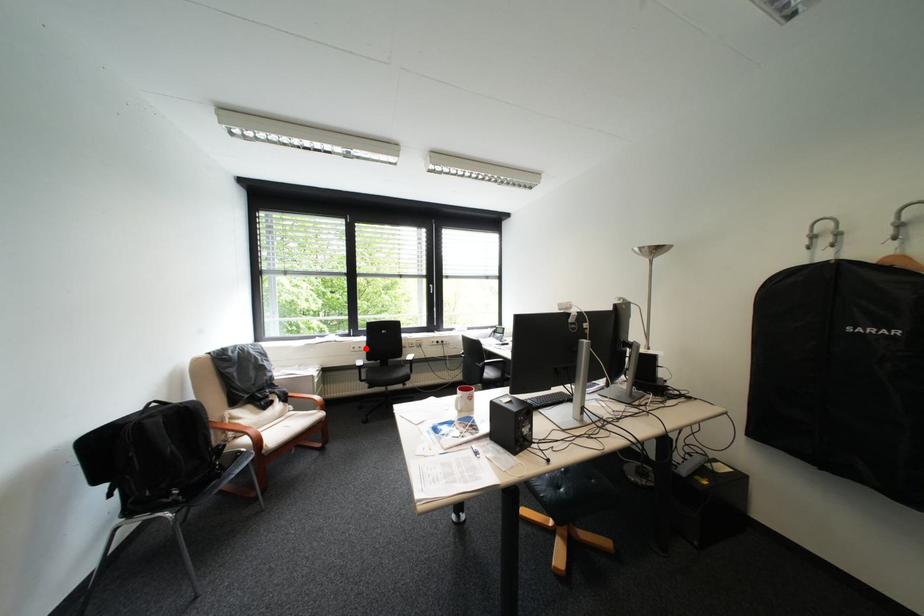
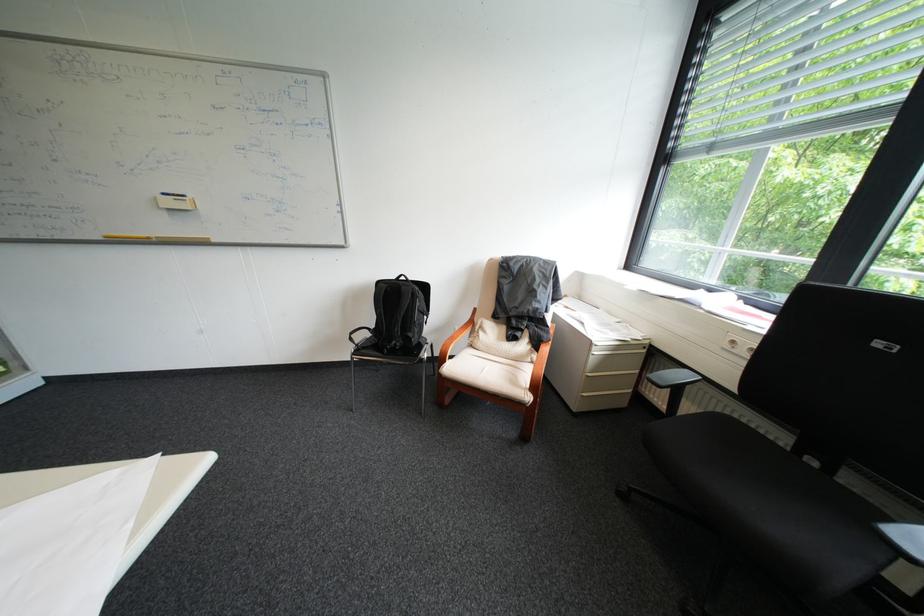
Question: A red point is marked in image1. In image2, is the corresponding 3D point closer to the camera or farther? Reply with the corresponding letter.

Choices:
 (A) The corresponding 3D point is closer.
 (B) The corresponding 3D point is farther.

Answer: (A)